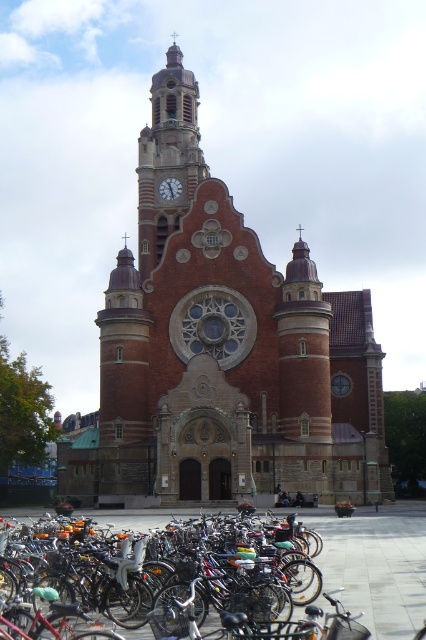
Question: In this image, where is red brick church at center located relative to shiny metallic bicycle at lower left?

Choices:
 (A) below
 (B) above

Answer: (B)

Question: Among these objects, which one is farthest from the camera?

Choices:
 (A) matte red clock at upper center
 (B) shiny metallic bicycle at lower left
 (C) brick clock tower at center
 (D) red brick church at center

Answer: (A)

Question: Which of the following is the closest to the observer?

Choices:
 (A) (184, 564)
 (B) (154, 115)
 (C) (170, 188)
 (D) (204, 241)

Answer: (A)

Question: Which of the following is the farthest from the observer?

Choices:
 (A) shiny metallic bicycle at lower left
 (B) matte red clock at upper center

Answer: (B)

Question: Does brick clock tower at center have a smaller size compared to matte red clock at upper center?

Choices:
 (A) no
 (B) yes

Answer: (A)

Question: In this image, where is red brick church at center located relative to brick clock tower at center?

Choices:
 (A) left
 (B) right

Answer: (B)